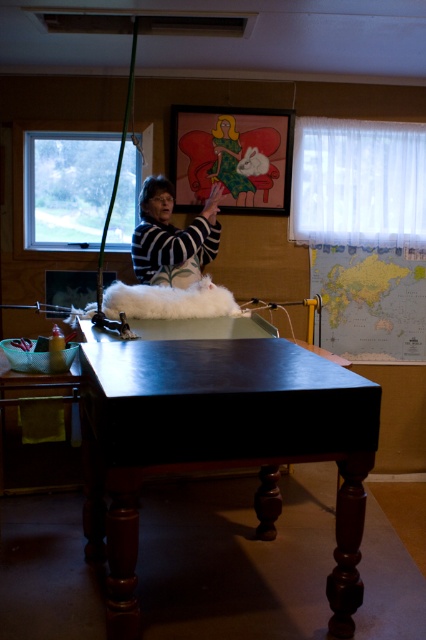
Can you confirm if shiny dark wood table at center is positioned below striped sweater at center?

Yes.

Which is below, shiny dark wood table at center or striped sweater at center?

shiny dark wood table at center

Is point (241, 461) farther from viewer compared to point (190, 282)?

No.

This screenshot has height=640, width=426. Identify the location of shiny dark wood table at center. (219, 444).